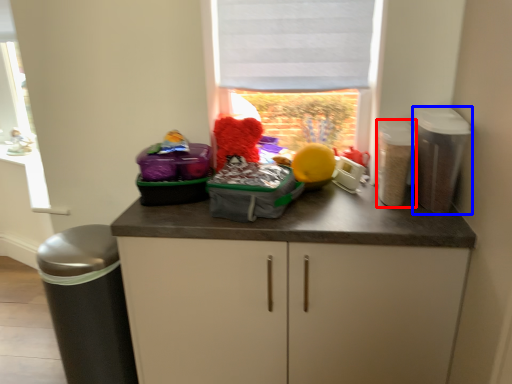
Question: Which object appears farthest to the camera in this image, appliance (highlighted by a red box) or appliance (highlighted by a blue box)?

Choices:
 (A) appliance
 (B) appliance

Answer: (A)